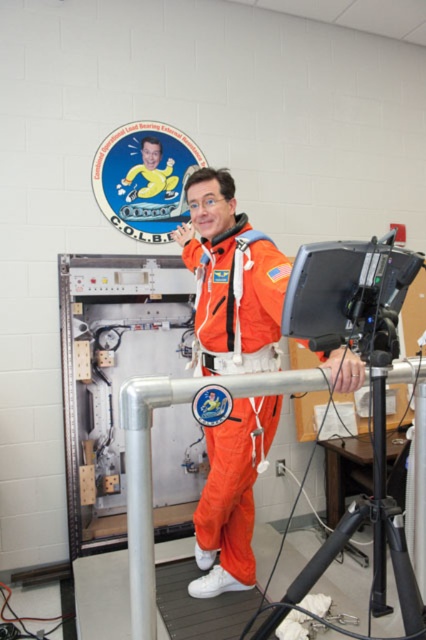
Question: Is orange fabric spacesuit at center positioned at the back of black plastic tripod at lower right?

Choices:
 (A) no
 (B) yes

Answer: (B)

Question: Which object is farther from the camera taking this photo?

Choices:
 (A) black plastic tripod at lower right
 (B) orange fabric spacesuit at center

Answer: (B)

Question: Can you confirm if orange fabric spacesuit at center is positioned above black plastic tripod at lower right?

Choices:
 (A) yes
 (B) no

Answer: (A)

Question: Can you confirm if orange fabric spacesuit at center is wider than black plastic tripod at lower right?

Choices:
 (A) no
 (B) yes

Answer: (B)

Question: Which of the following is the farthest from the observer?

Choices:
 (A) orange fabric spacesuit at center
 (B) black plastic tripod at lower right

Answer: (A)